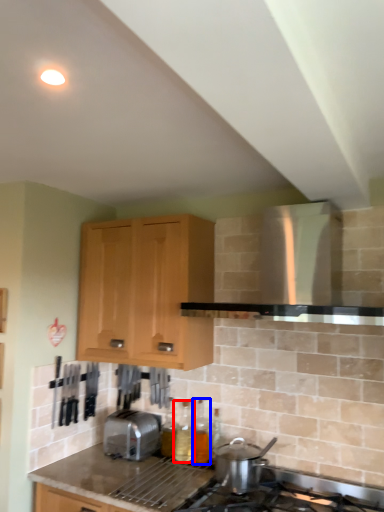
Question: Which object is closer to the camera taking this photo, bottle (highlighted by a red box) or bottle (highlighted by a blue box)?

Choices:
 (A) bottle
 (B) bottle

Answer: (B)